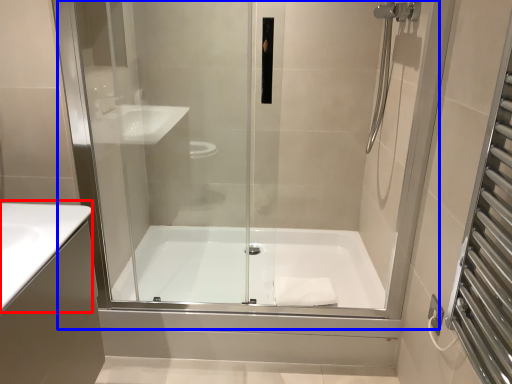
Question: Which point is closer to the camera, counter top (highlighted by a red box) or shower door (highlighted by a blue box)?

Choices:
 (A) counter top
 (B) shower door

Answer: (A)